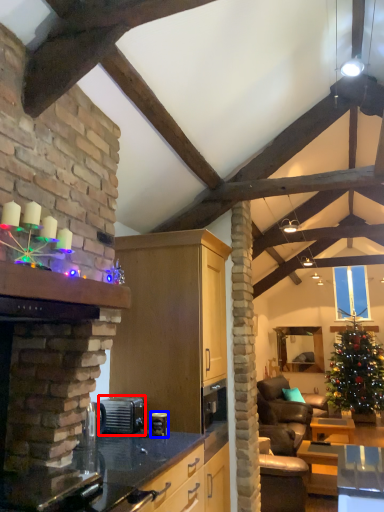
Question: Which point is closer to the camera, appliance (highlighted by a red box) or appliance (highlighted by a blue box)?

Choices:
 (A) appliance
 (B) appliance

Answer: (B)